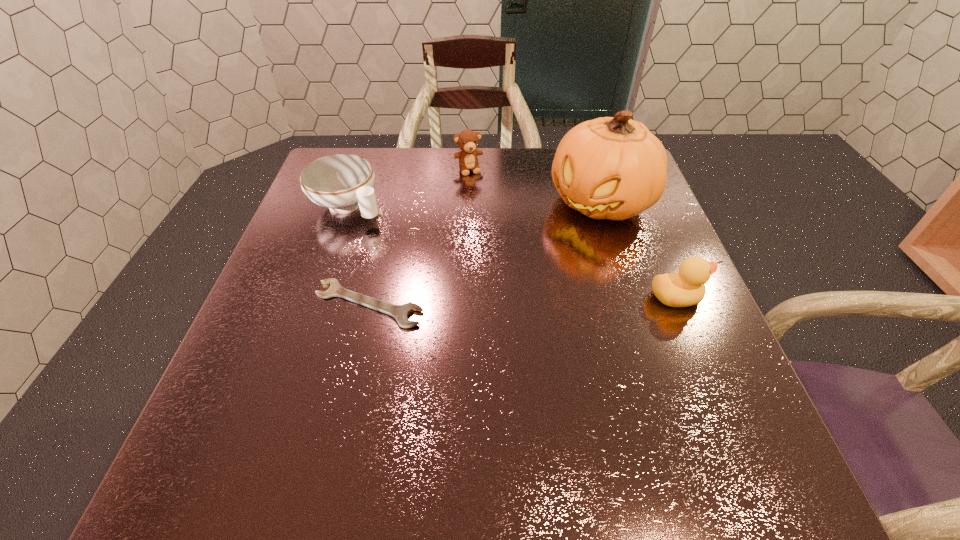
Where is `free space on the desktop that is between the wrench and the duckling and is positioned on the side with the handle of the chinaware`? The width and height of the screenshot is (960, 540). free space on the desktop that is between the wrench and the duckling and is positioned on the side with the handle of the chinaware is located at coordinates (480, 301).

Where is `free space on the desktop that is between the wrench and the duckling and is positioned on the front face of the pumpkin`? The width and height of the screenshot is (960, 540). free space on the desktop that is between the wrench and the duckling and is positioned on the front face of the pumpkin is located at coordinates (496, 301).

Where is `free space on the desktop that is between the shortest object and the duckling and is positioned on the face of the teddy bear`? free space on the desktop that is between the shortest object and the duckling and is positioned on the face of the teddy bear is located at coordinates (526, 300).